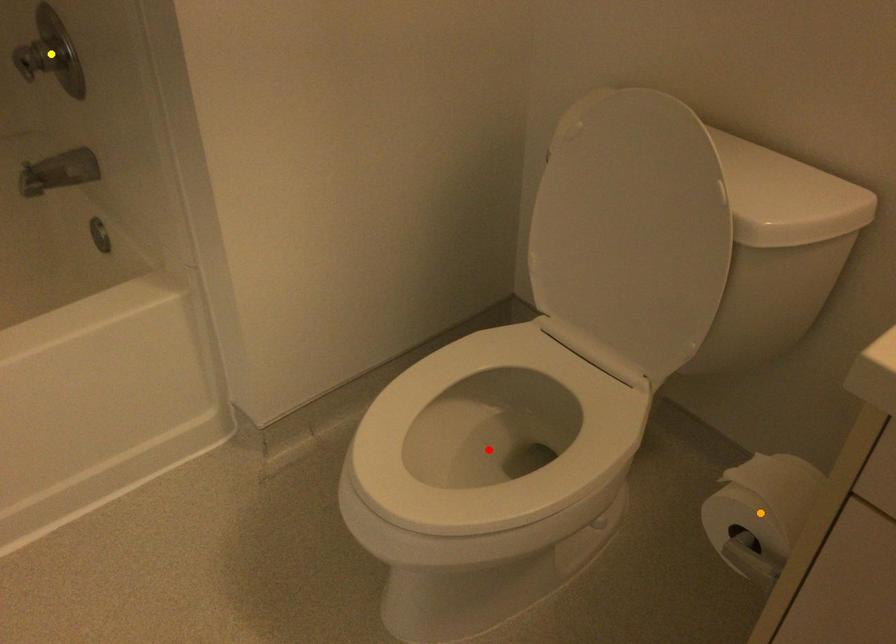
Order these from nearest to farthest:
- red point
- yellow point
- orange point

orange point < red point < yellow point